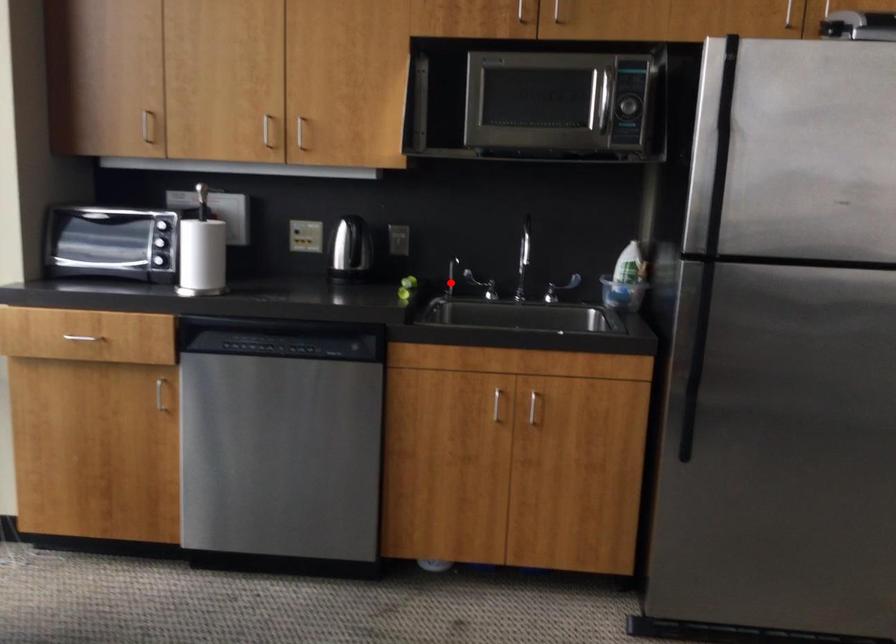
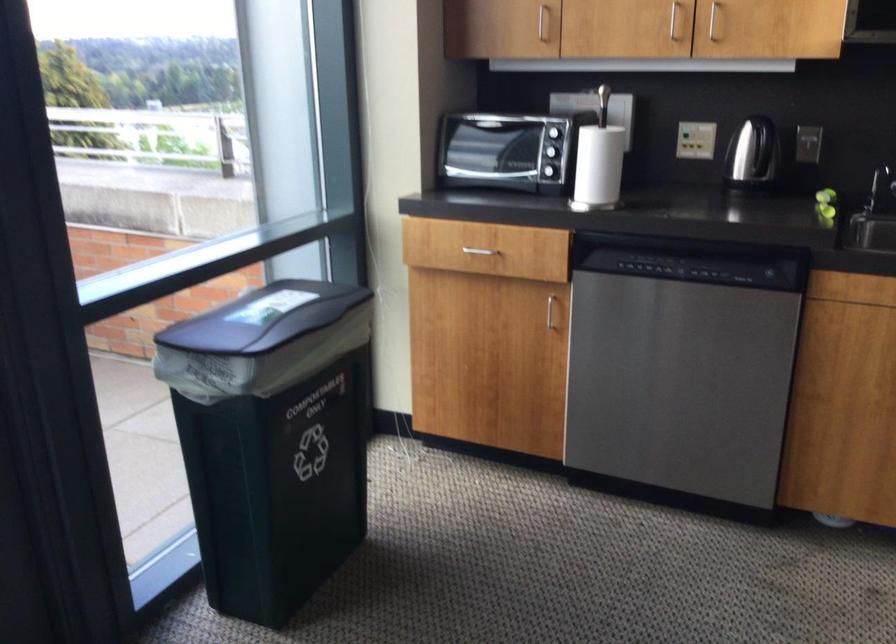
Locate, in the second image, the point that corresponds to the highlighted location in the first image.

(879, 187)